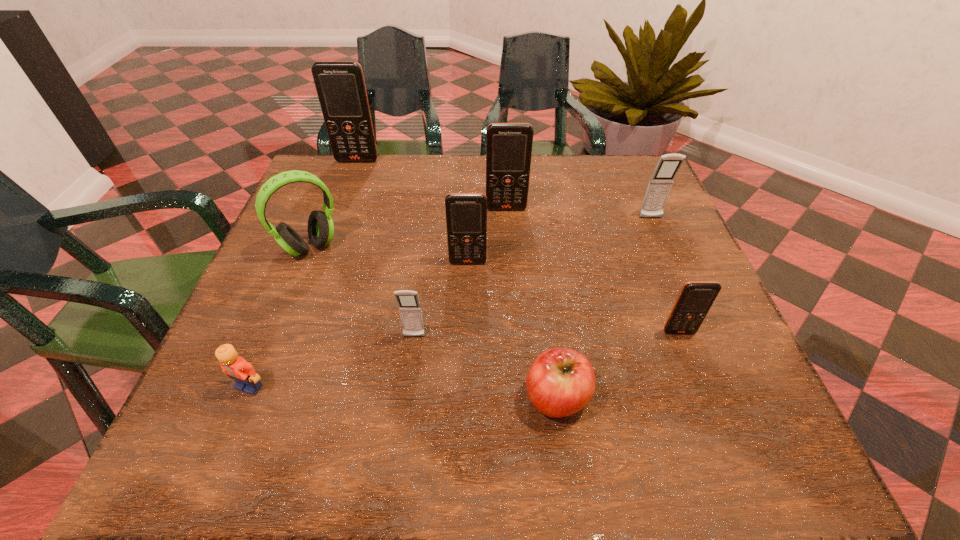
This screenshot has height=540, width=960. In order to click on free space at the near edge in this screenshot , I will do `click(473, 426)`.

You are a GUI agent. You are given a task and a screenshot of the screen. Output one action in this format:
    pyautogui.click(x=<x>, y=<y>)
    Task: Click on the vacant area at the left edge
    The image size is (960, 540).
    Given the screenshot: What is the action you would take?
    pyautogui.click(x=257, y=347)

Image resolution: width=960 pixels, height=540 pixels. Identify the location of vacant space at the right edge of the desktop. (695, 277).

In the image, there is a desktop. What are the coordinates of `blank space at the near left corner` in the screenshot? It's located at (193, 431).

Identify the location of blank space at the far right corner of the desktop. The height and width of the screenshot is (540, 960). coord(602,176).

The width and height of the screenshot is (960, 540). In order to click on vacant area between the apple and the Lego in this screenshot , I will do `click(403, 392)`.

Image resolution: width=960 pixels, height=540 pixels. What are the coordinates of `empty space that is in between the orange Lego and the green headset` in the screenshot? It's located at (280, 316).

Find the location of a particular element. The height and width of the screenshot is (540, 960). unoccupied position between the farther gray cellular telephone and the nearest orange cellular telephone is located at coordinates (664, 275).

Where is `empty space between the leftmost orange cellular telephone and the orange Lego`? empty space between the leftmost orange cellular telephone and the orange Lego is located at coordinates pos(303,273).

What are the coordinates of `free area in between the Lego and the second smallest orange cellular telephone` in the screenshot? It's located at (359, 324).